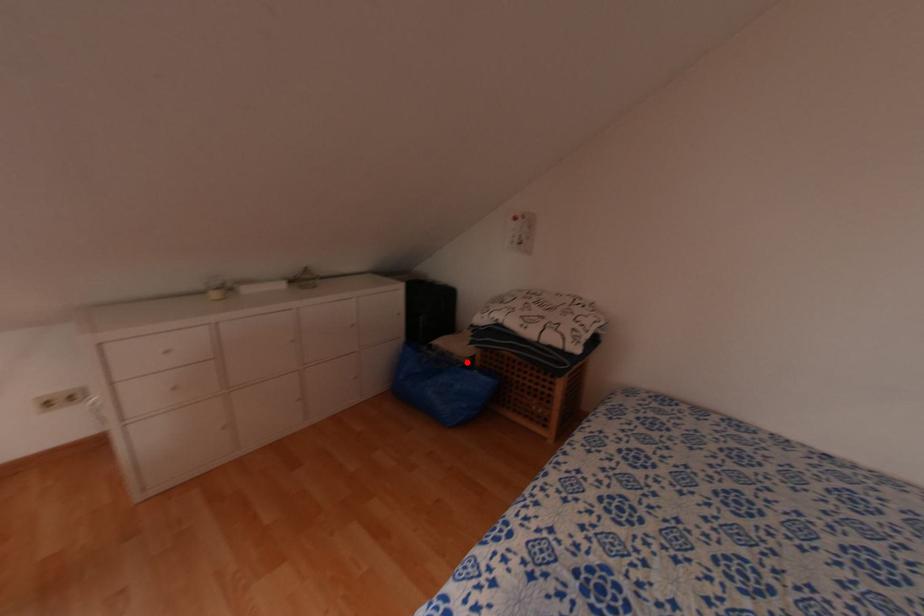
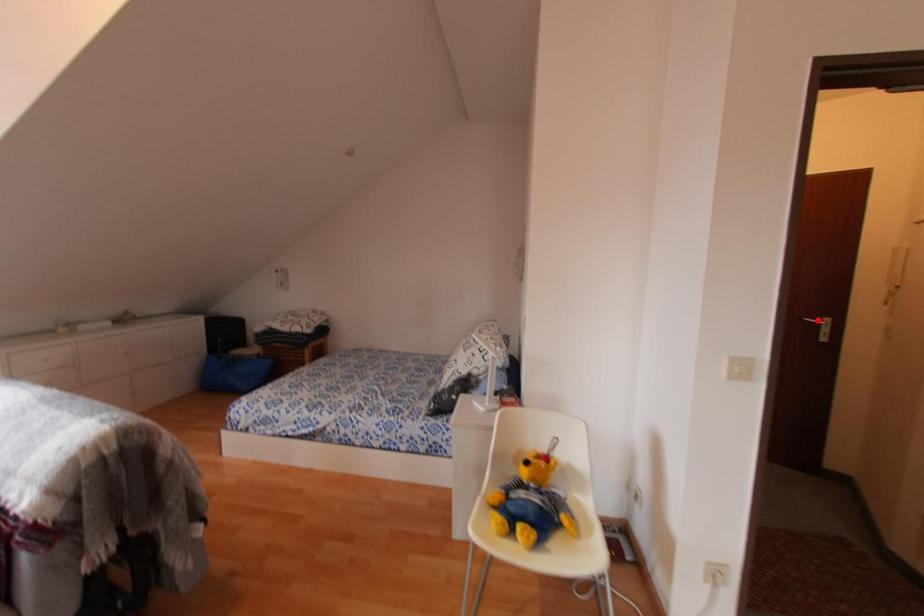
I am providing you with two images of the same scene from different viewpoints. A red point is marked on the first image and another point is marked on the second image. Is the marked point in image1 the same physical position as the marked point in image2?

No